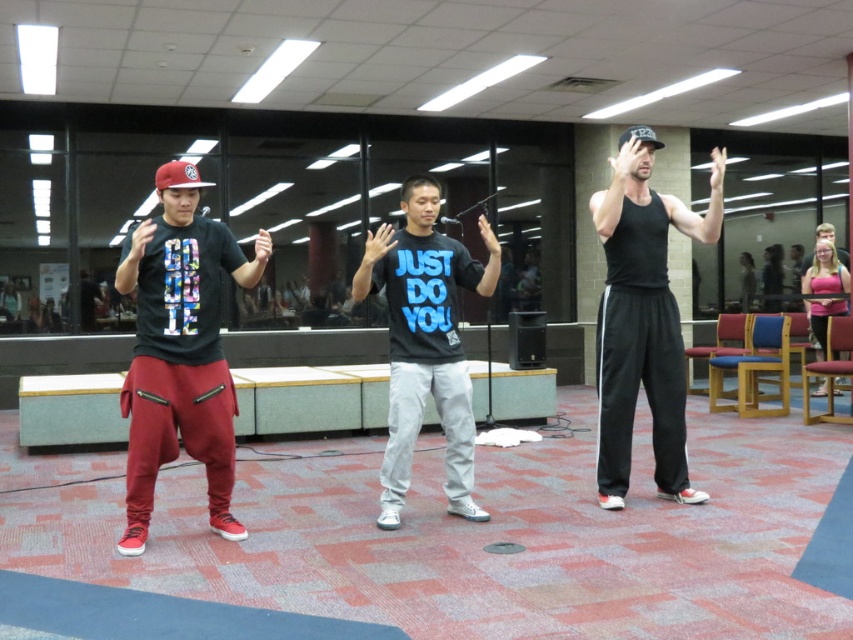
Can you confirm if matte black t-shirt at center is wider than black matte t-shirt at center?

Yes.

Who is more forward, (207, 241) or (465, 483)?

Point (207, 241) is more forward.

Which is in front, point (152, 275) or point (431, 180)?

Point (152, 275) is in front.

What are the coordinates of `matte black t-shirt at center` in the screenshot? It's located at click(x=180, y=349).

Is black tank top at right to the left of black matte t-shirt at center from the viewer's perspective?

In fact, black tank top at right is to the right of black matte t-shirt at center.

Is black tank top at right thinner than black matte t-shirt at center?

No.

Which is behind, point (601, 355) or point (437, 212)?

Positioned behind is point (601, 355).

Where is `black tank top at right`? The image size is (853, 640). black tank top at right is located at coordinates (643, 317).

Can you confirm if matte black t-shirt at center is positioned to the right of black tank top at right?

In fact, matte black t-shirt at center is to the left of black tank top at right.

This screenshot has height=640, width=853. What do you see at coordinates (180, 349) in the screenshot? I see `matte black t-shirt at center` at bounding box center [180, 349].

This screenshot has height=640, width=853. In order to click on matte black t-shirt at center in this screenshot , I will do `click(180, 349)`.